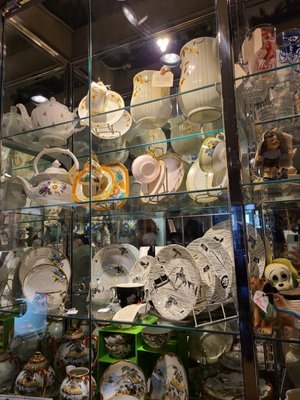
Image resolution: width=300 pixels, height=400 pixels. In order to click on plates on top shelf in this screenshot , I will do `click(112, 105)`, `click(119, 128)`.